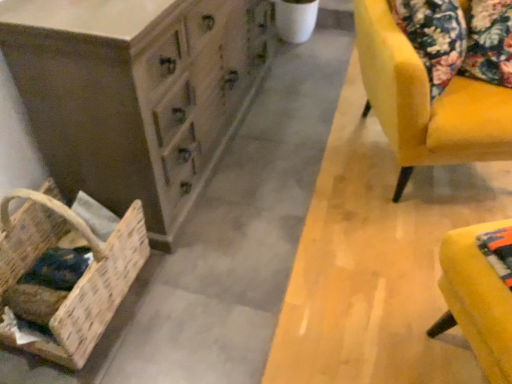
The image size is (512, 384). Identify the location of free spot behind yellow fabric ottoman at lower right. (406, 257).